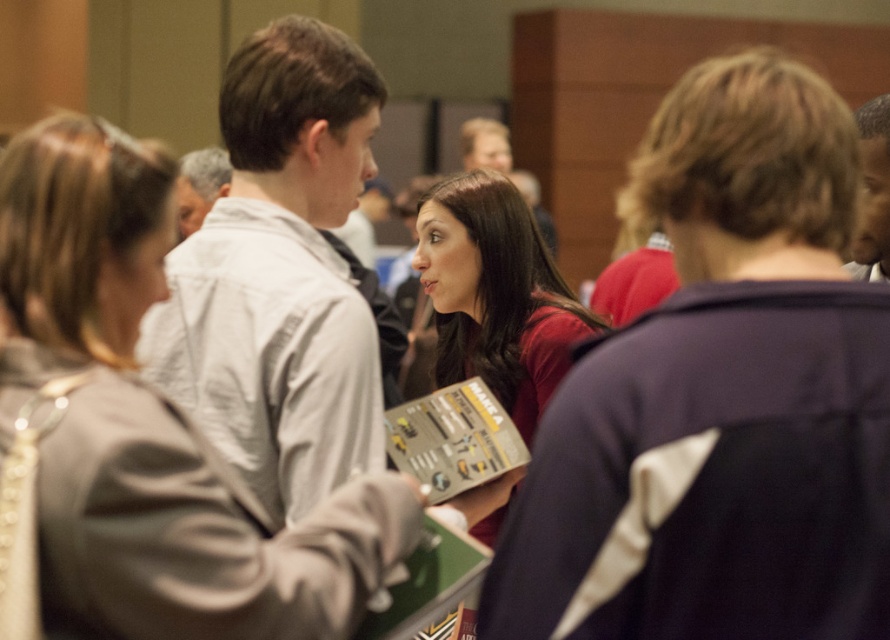
Which of these two, dark brown hair at upper right or light gray jacket at center, stands taller?

Standing taller between the two is dark brown hair at upper right.

Is dark brown hair at upper right taller than light gray jacket at center?

Yes.

Image resolution: width=890 pixels, height=640 pixels. I want to click on dark brown hair at upper right, so click(x=872, y=193).

Does matte red shirt at center appear on the left side of dark brown hair at upper right?

Correct, you'll find matte red shirt at center to the left of dark brown hair at upper right.

Does point (468, 289) come farther from viewer compared to point (863, 193)?

Yes.

Between point (565, 288) and point (859, 240), which one is positioned in front?

Point (859, 240) is more forward.

Image resolution: width=890 pixels, height=640 pixels. Identify the location of matte red shirt at center. (496, 294).

Which is below, matte gray hoodie at center or matte red shirt at center?

matte gray hoodie at center is below.

Find the location of a particular element. matte gray hoodie at center is located at coordinates (151, 428).

Identify the location of matte gray hoodie at center. This screenshot has height=640, width=890. (151, 428).